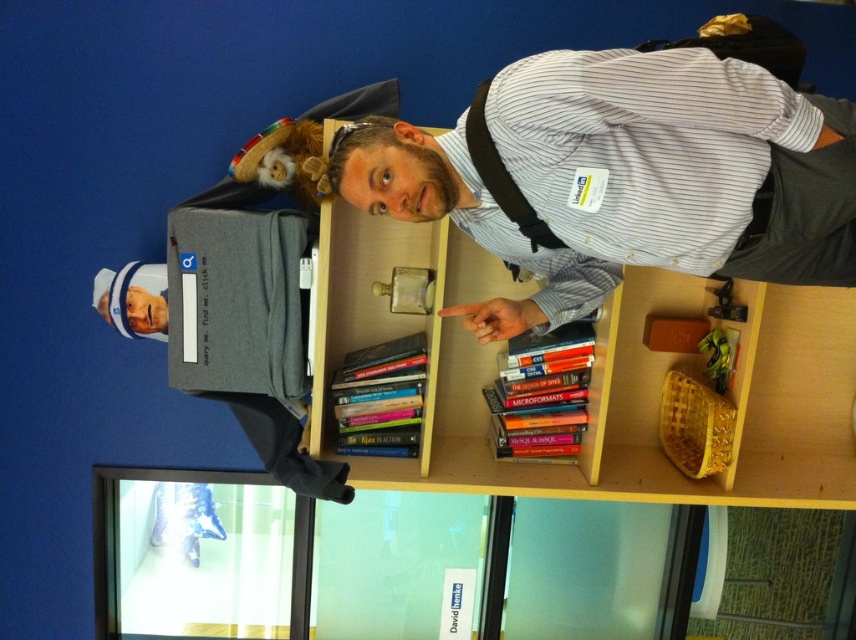
Question: Does striped cotton shirt at center have a larger size compared to wooden bookcase at center?

Choices:
 (A) no
 (B) yes

Answer: (A)

Question: Which point is farther to the camera?

Choices:
 (A) wooden bookcase at center
 (B) striped cotton shirt at center

Answer: (A)

Question: Can you confirm if striped cotton shirt at center is smaller than wooden bookcase at center?

Choices:
 (A) no
 (B) yes

Answer: (B)

Question: Among these points, which one is nearest to the camera?

Choices:
 (A) (354, 180)
 (B) (468, 422)

Answer: (A)

Question: Which of the following is the farthest from the observer?

Choices:
 (A) striped cotton shirt at center
 (B) wooden bookcase at center

Answer: (B)

Question: Is striped cotton shirt at center above wooden bookcase at center?

Choices:
 (A) yes
 (B) no

Answer: (A)